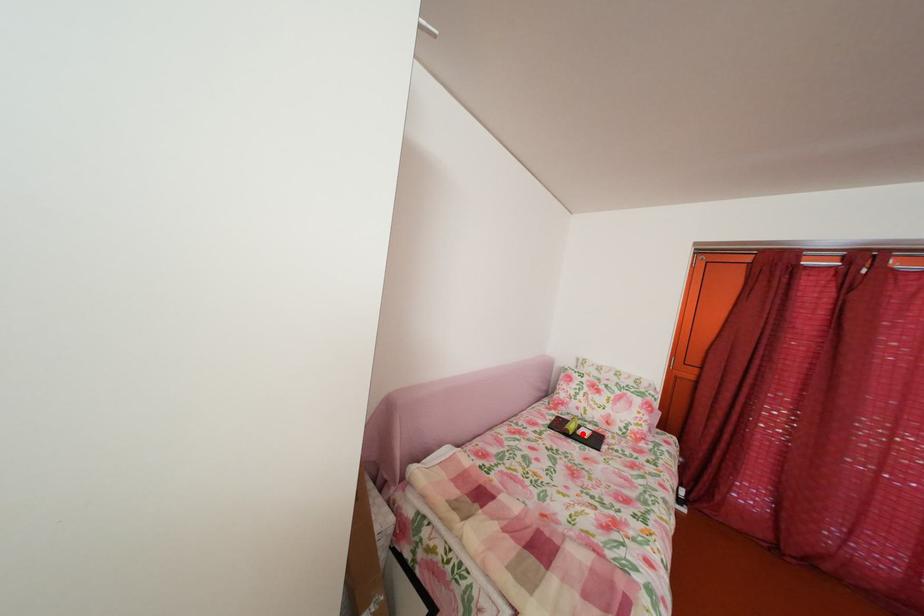
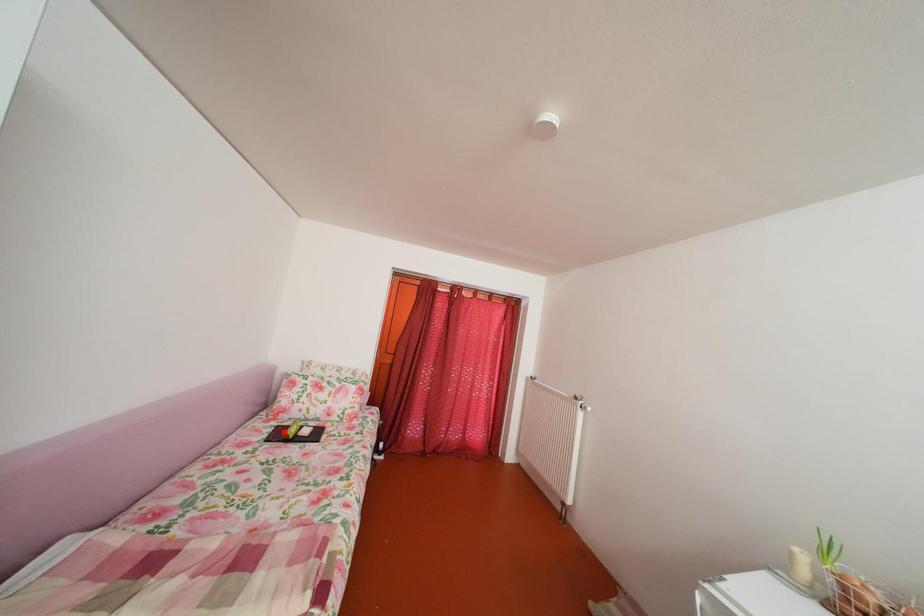
I am providing you with two images of the same scene from different viewpoints. A red point is marked on the first image and another point is marked on the second image. Is the red point in image1 aligned with the point shown in image2?

No